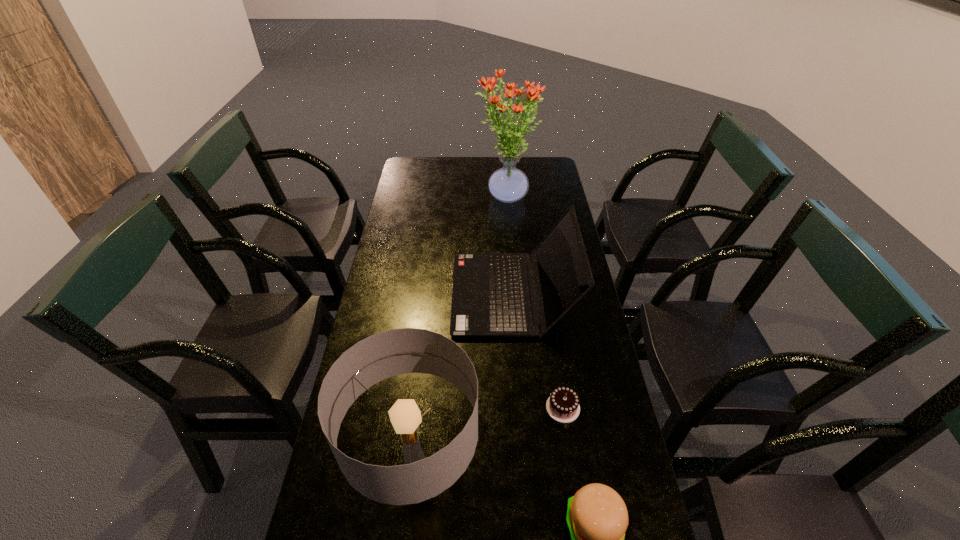
The height and width of the screenshot is (540, 960). Identify the location of free space between the fourth nearest object and the farthest object. (509, 246).

You are a GUI agent. You are given a task and a screenshot of the screen. Output one action in this format:
    pyautogui.click(x=<x>, y=<y>)
    Task: Click on the vacant region between the fourth nearest object and the third farthest object
    The width and height of the screenshot is (960, 540).
    Given the screenshot: What is the action you would take?
    click(x=538, y=350)

Locate an element on the screen. The height and width of the screenshot is (540, 960). blank region between the third shortest object and the farthest object is located at coordinates (509, 246).

I want to click on unoccupied area between the chocolate cake and the laptop computer, so click(538, 350).

Locate which object ranks second in proximity to the third shortest object. Please provide its 2D coordinates. Your answer should be formatted as a tuple, i.e. [(x, y)], where the tuple contains the x and y coordinates of a point satisfying the conditions above.

[(508, 184)]

Locate an element on the screen. This screenshot has width=960, height=540. the closest object to the third shortest object is located at coordinates (563, 406).

You are a GUI agent. You are given a task and a screenshot of the screen. Output one action in this format:
    pyautogui.click(x=<x>, y=<y>)
    Task: Click on the free space that satisfies the following two spatial constraints: 1. on the screen of the second farthest object; 2. on the back side of the third nearest object
    
    Given the screenshot: What is the action you would take?
    pyautogui.click(x=521, y=408)

The width and height of the screenshot is (960, 540). I want to click on vacant region that satisfies the following two spatial constraints: 1. on the screen of the third shortest object; 2. on the left side of the shortest object, so click(x=521, y=408).

In order to click on free space in the image that satisfies the following two spatial constraints: 1. on the screen of the fourth nearest object; 2. on the back side of the shortest object in this screenshot , I will do `click(521, 408)`.